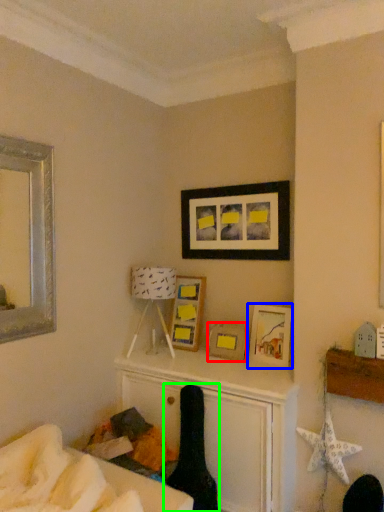
Question: Which object is the farthest from picture frame (highlighted by a red box)? Choose among these: picture frame (highlighted by a blue box) or swivel chair (highlighted by a green box).

Choices:
 (A) picture frame
 (B) swivel chair

Answer: (B)